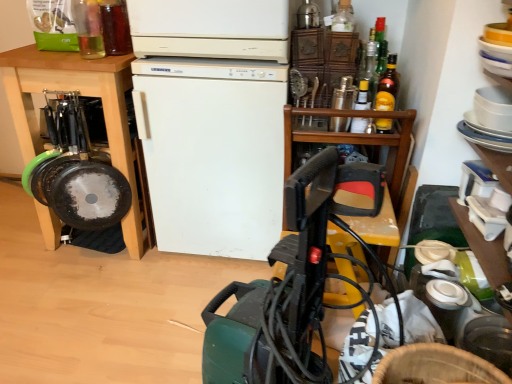
Measure the distance between translucent glass bottle at upper right, which is the 2th bottle from right to left, and camera.

They are 1.45 meters apart.

Describe the element at coordinates (362, 96) in the screenshot. This screenshot has width=512, height=384. I see `yellow glass bottle at upper center, arranged as the third bottle when viewed from the right` at that location.

I want to click on yellow glass bottle at upper center, the 4th bottle when ordered from left to right, so click(362, 96).

The height and width of the screenshot is (384, 512). Describe the element at coordinates (212, 152) in the screenshot. I see `white matte refrigerator at center` at that location.

How much space does clear glass bottle at upper left, which appears as the first bottle when viewed from the left, occupy horizontally?

clear glass bottle at upper left, which appears as the first bottle when viewed from the left, is 7.70 centimeters in width.

This screenshot has width=512, height=384. Describe the element at coordinates (88, 28) in the screenshot. I see `clear glass bottle at upper left, which appears as the first bottle when viewed from the left` at that location.

At what (x,y) coordinates should I click in order to perform the action: click on translucent glass bottle at upper right, which is the 2th bottle from right to left. Please return your answer as a coordinate pair (x, y). Looking at the image, I should click on (369, 71).

From a real-world perspective, is yellow glass bottle at upper right, the 1th bottle in the right-to-left sequence, on clear glass bottle at upper left, which appears as the first bottle when viewed from the left?

No, from a real-world perspective, yellow glass bottle at upper right, the 1th bottle in the right-to-left sequence, is not on top of clear glass bottle at upper left, which appears as the first bottle when viewed from the left.

Is yellow glass bottle at upper right, the 1th bottle in the right-to-left sequence, positioned beyond the bounds of clear glass bottle at upper left, acting as the sixth bottle starting from the right?

Indeed, yellow glass bottle at upper right, the 1th bottle in the right-to-left sequence, is completely outside clear glass bottle at upper left, acting as the sixth bottle starting from the right.

Where is `bottle that is the 5th object to the left of the yellow glass bottle at upper right, arranged as the 6th bottle when viewed from the left, starting at the anchor`? bottle that is the 5th object to the left of the yellow glass bottle at upper right, arranged as the 6th bottle when viewed from the left, starting at the anchor is located at coordinates (88, 28).

Is yellow glass bottle at upper right, arranged as the 6th bottle when viewed from the left, at the left side of clear glass bottle at upper left, which appears as the first bottle when viewed from the left?

In fact, yellow glass bottle at upper right, arranged as the 6th bottle when viewed from the left, is to the right of clear glass bottle at upper left, which appears as the first bottle when viewed from the left.

Based on the photo, is translucent glass bottle at upper right, which is the 2th bottle from right to left, in front of or behind white matte refrigerator at center in the image?

Visually, translucent glass bottle at upper right, which is the 2th bottle from right to left, is located behind white matte refrigerator at center.

Is point (374, 55) closer to viewer compared to point (243, 96)?

No, (374, 55) is further to viewer.

From the picture: Which object is wider, translucent glass bottle at upper right, which is the 2th bottle from right to left, or white matte refrigerator at center?

white matte refrigerator at center.

From the image's perspective, which one is positioned lower, translucent glass bottle at upper right, which ranks as the fifth bottle in left-to-right order, or white matte refrigerator at center?

From the image's view, white matte refrigerator at center is below.

From the image's perspective, who appears lower, green plastic vacuum cleaner at center or wooden cabinet at left?

green plastic vacuum cleaner at center appears lower in the image.

Is green plastic vacuum cleaner at center looking in the opposite direction of wooden cabinet at left?

green plastic vacuum cleaner at center does not have its back to wooden cabinet at left.

Is wooden cabinet at left located within green plastic vacuum cleaner at center?

No, green plastic vacuum cleaner at center does not contain wooden cabinet at left.

Which is nearer, (212, 304) or (128, 57)?

The point (212, 304) is more forward.

From a real-world perspective, is translucent glass bottle at upper left, placed as the second bottle when sorted from left to right, on translucent glass bottle at upper right, which is the 2th bottle from right to left?

Yes, from a real-world perspective, translucent glass bottle at upper left, placed as the second bottle when sorted from left to right, is on top of translucent glass bottle at upper right, which is the 2th bottle from right to left.

Is translucent glass bottle at upper left, placed as the second bottle when sorted from left to right, directly adjacent to translucent glass bottle at upper right, which ranks as the fifth bottle in left-to-right order?

They are not placed beside each other.

From the image's perspective, which one is positioned lower, translucent glass bottle at upper left, the fifth bottle in the right-to-left sequence, or translucent glass bottle at upper right, which is the 2th bottle from right to left?

translucent glass bottle at upper right, which is the 2th bottle from right to left, appears lower in the image.

Considering their positions, is translucent glass bottle at upper left, placed as the second bottle when sorted from left to right, located in front of or behind translucent glass bottle at upper right, which is the 2th bottle from right to left?

translucent glass bottle at upper left, placed as the second bottle when sorted from left to right, is in front of translucent glass bottle at upper right, which is the 2th bottle from right to left.

Which of these two, translucent glass bottle at upper right, which ranks as the fifth bottle in left-to-right order, or translucent glass bottle at upper left, the fifth bottle in the right-to-left sequence, is bigger?

translucent glass bottle at upper left, the fifth bottle in the right-to-left sequence.

Is translucent glass bottle at upper right, which is the 2th bottle from right to left, surrounding translucent glass bottle at upper left, placed as the second bottle when sorted from left to right?

No, translucent glass bottle at upper left, placed as the second bottle when sorted from left to right, is not surrounded by translucent glass bottle at upper right, which is the 2th bottle from right to left.

Locate an element on the screen. This screenshot has width=512, height=384. the 3rd bottle counting from the right of the translucent glass bottle at upper left, the fifth bottle in the right-to-left sequence is located at coordinates (369, 71).

Looking at this image, from a real-world perspective, between yellow glass bottle at upper center, arranged as the third bottle when viewed from the right, and clear glass bottle at upper left, which appears as the first bottle when viewed from the left, who is vertically higher?

In real-world perspective, clear glass bottle at upper left, which appears as the first bottle when viewed from the left, is above.

Does yellow glass bottle at upper center, the 4th bottle when ordered from left to right, appear on the left side of clear glass bottle at upper left, which appears as the first bottle when viewed from the left?

In fact, yellow glass bottle at upper center, the 4th bottle when ordered from left to right, is to the right of clear glass bottle at upper left, which appears as the first bottle when viewed from the left.

From the image's perspective, which one is positioned higher, yellow glass bottle at upper center, arranged as the third bottle when viewed from the right, or clear glass bottle at upper left, which appears as the first bottle when viewed from the left?

clear glass bottle at upper left, which appears as the first bottle when viewed from the left, is shown above in the image.

From the image's perspective, is wooden at upper right above or below wooden cabinet at left?

wooden at upper right is below wooden cabinet at left.

From a real-world perspective, relative to wooden cabinet at left, is wooden at upper right vertically above or below?

From a real-world perspective, wooden at upper right is physically below wooden cabinet at left.

Is wooden at upper right in contact with wooden cabinet at left?

No, wooden at upper right is not beside wooden cabinet at left.

Is wooden at upper right to the left or to the right of wooden cabinet at left in the image?

wooden at upper right is positioned on wooden cabinet at left's right side.

I want to click on bottle that is the 2nd one below the clear glass bottle at upper left, acting as the sixth bottle starting from the right (from a real-world perspective), so click(388, 86).

The height and width of the screenshot is (384, 512). In the image, there is a translucent glass bottle at upper right, which ranks as the fifth bottle in left-to-right order. In order to click on refrigerator below it (from the image's perspective) in this screenshot , I will do `click(212, 152)`.

Considering their positions, is white matte refrigerator at center positioned closer to clear glass bottle at upper left, acting as the sixth bottle starting from the right, than translucent glass bottle at upper right, which is the 2th bottle from right to left?

white matte refrigerator at center is positioned closer to the anchor clear glass bottle at upper left, acting as the sixth bottle starting from the right.

Based on their spatial positions, is yellow glass bottle at upper center, the 4th bottle when ordered from left to right, or yellow glass bottle at upper right, arranged as the 6th bottle when viewed from the left, closer to wooden at upper right?

yellow glass bottle at upper center, the 4th bottle when ordered from left to right, lies closer to wooden at upper right than the other object.

Looking at the image, which one is located further to yellow glass bottle at upper right, arranged as the 6th bottle when viewed from the left, translucent glass bottle at upper right, which is the 2th bottle from right to left, or green plastic vacuum cleaner at center?

Based on the image, green plastic vacuum cleaner at center appears to be further to yellow glass bottle at upper right, arranged as the 6th bottle when viewed from the left.

Looking at the image, which one is located closer to metallic silver shaker at upper right, which ranks as the 4th bottle in right-to-left order, yellow glass bottle at upper right, arranged as the 6th bottle when viewed from the left, or wooden at upper right?

Based on the image, yellow glass bottle at upper right, arranged as the 6th bottle when viewed from the left, appears to be nearer to metallic silver shaker at upper right, which ranks as the 4th bottle in right-to-left order.

From the image, which object appears to be farther from wooden at upper right, metallic silver shaker at upper right, which is the third bottle from left to right, or translucent glass bottle at upper left, placed as the second bottle when sorted from left to right?

The object further to wooden at upper right is translucent glass bottle at upper left, placed as the second bottle when sorted from left to right.

Looking at this image, based on their spatial positions, is translucent glass bottle at upper left, the fifth bottle in the right-to-left sequence, or white matte refrigerator at center closer to yellow glass bottle at upper center, the 4th bottle when ordered from left to right?

Based on the image, white matte refrigerator at center appears to be nearer to yellow glass bottle at upper center, the 4th bottle when ordered from left to right.

Based on their spatial positions, is white matte refrigerator at center or translucent glass bottle at upper right, which ranks as the fifth bottle in left-to-right order, further from translucent glass bottle at upper left, placed as the second bottle when sorted from left to right?

translucent glass bottle at upper right, which ranks as the fifth bottle in left-to-right order.

Which object lies nearer to the anchor point wooden cabinet at left, metallic silver shaker at upper right, which is the third bottle from left to right, or yellow glass bottle at upper center, arranged as the third bottle when viewed from the right?

Based on the image, metallic silver shaker at upper right, which is the third bottle from left to right, appears to be nearer to wooden cabinet at left.

Identify the location of table between clear glass bottle at upper left, which appears as the first bottle when viewed from the left, and translucent glass bottle at upper right, which ranks as the fifth bottle in left-to-right order, in the horizontal direction. This screenshot has width=512, height=384. (364, 144).

Image resolution: width=512 pixels, height=384 pixels. I want to click on table between wooden cabinet at left and yellow glass bottle at upper center, the 4th bottle when ordered from left to right, in the horizontal direction, so click(x=364, y=144).

Locate an element on the screen. The width and height of the screenshot is (512, 384). refrigerator between wooden cabinet at left and yellow glass bottle at upper center, the 4th bottle when ordered from left to right is located at coordinates (212, 152).

Where is `refrigerator between clear glass bottle at upper left, which appears as the first bottle when viewed from the left, and translucent glass bottle at upper right, which ranks as the fifth bottle in left-to-right order`? refrigerator between clear glass bottle at upper left, which appears as the first bottle when viewed from the left, and translucent glass bottle at upper right, which ranks as the fifth bottle in left-to-right order is located at coordinates (212, 152).